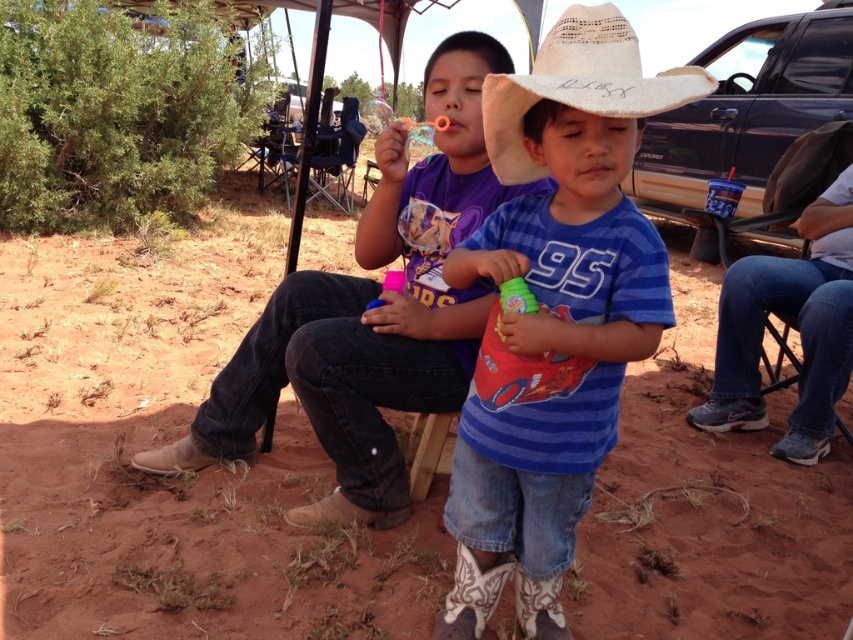
You are a photographer trying to capture both the blue striped shirt at center and the straw hat at center in a single frame. Based on their heights, which object should you focus on first to ensure both are in the shot?

The blue striped shirt at center is taller than the straw hat at center, so you should focus on the blue striped shirt at center first to ensure both are in the shot.

Consider the image. You are a photographer trying to capture both the denim jeans at center and the straw hat at center in a single frame. Since you can only focus on one subject at a time, which one should you focus on first to ensure both are in the frame?

The denim jeans at center is positioned on the left side of straw hat at center, so you should focus on the denim jeans at center first to ensure both are in the frame.

You are a photographer trying to capture a clear shot of both the denim jeans at center and the straw hat at center. Since you want both items in focus, which one should you adjust your camera focus on first?

You should focus on the denim jeans at center first because it is closer to the viewer than the straw hat at center, ensuring both are in focus when using depth of field properly.